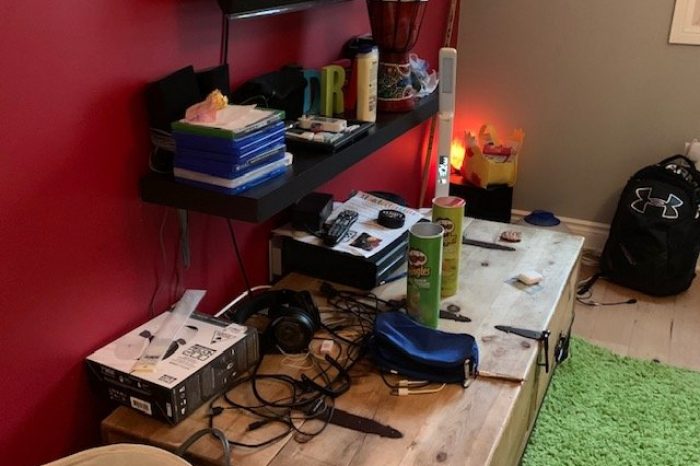
Image resolution: width=700 pixels, height=466 pixels. I want to click on yellow light, so (458, 161).